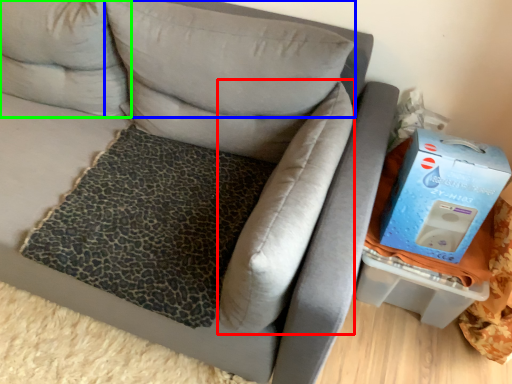
Question: Which is farther away from pillow (highlighted by a red box)? pillow (highlighted by a blue box) or pillow (highlighted by a green box)?

Choices:
 (A) pillow
 (B) pillow

Answer: (B)